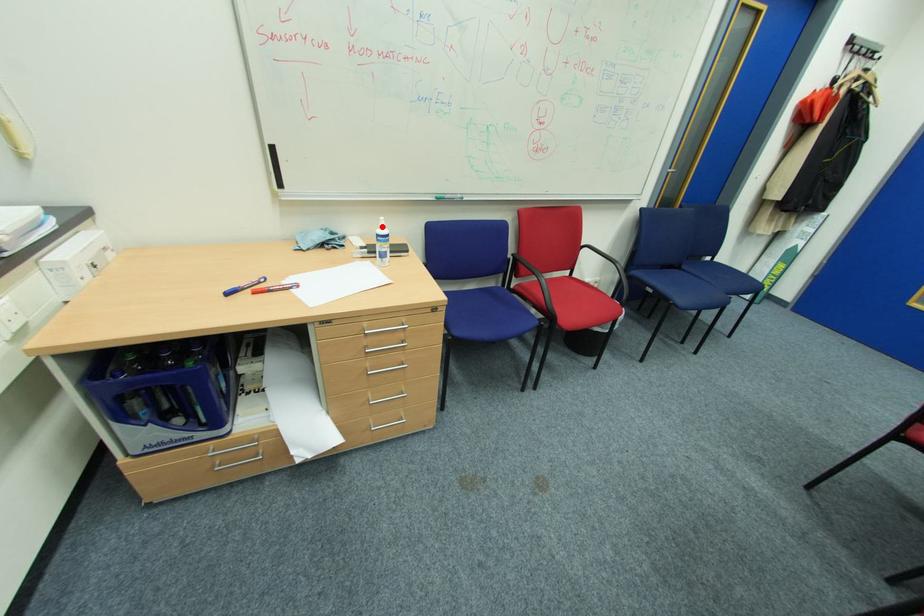
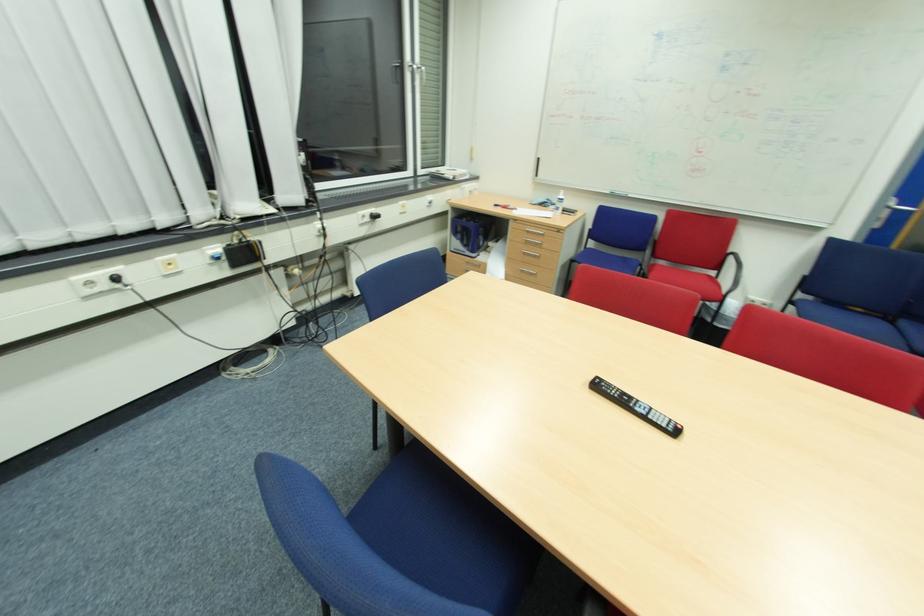
Question: I am providing you with two images of the same scene from different viewpoints. Image1 has a red point marked. In image2, the corresponding 3D location appears at what relative position? Reply with the corresponding letter.

Choices:
 (A) Closer
 (B) Farther

Answer: (A)